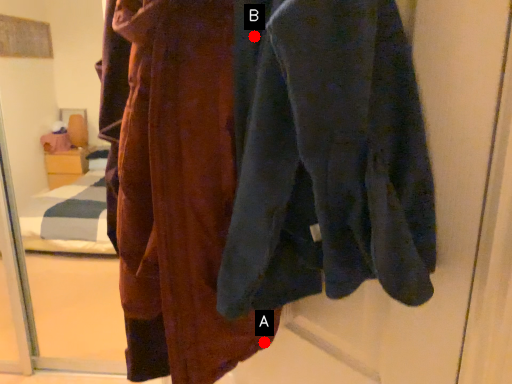
Question: Two points are circled on the image, labeled by A and B beside each circle. Which point is farther to the camera?

Choices:
 (A) A is further
 (B) B is further

Answer: (A)